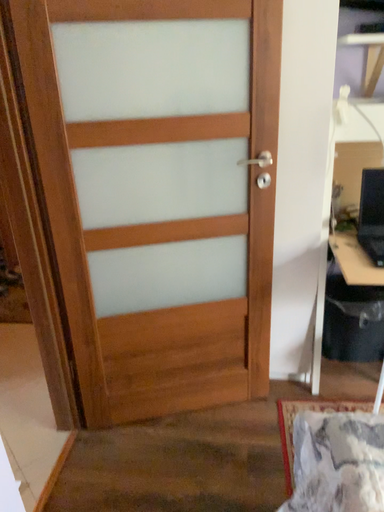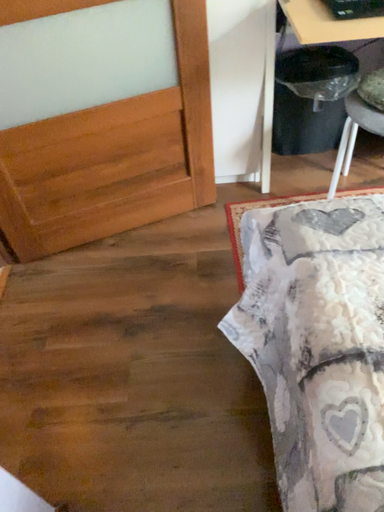
Question: Which way did the camera rotate in the video?

Choices:
 (A) rotated downward
 (B) rotated upward

Answer: (A)